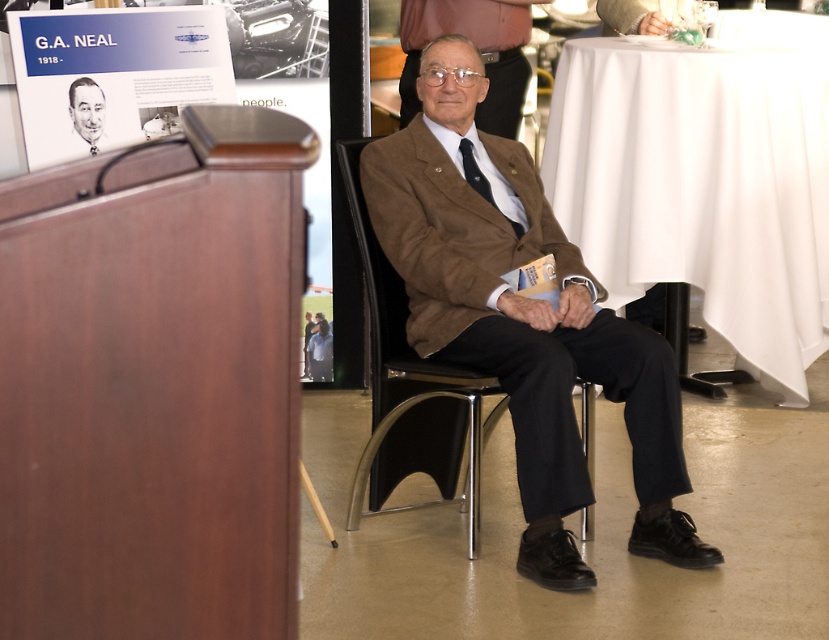
Question: In this image, where is matte paper poster at upper left located relative to matte black portrait at upper left?

Choices:
 (A) right
 (B) left

Answer: (A)

Question: Can you confirm if black plastic chair at center is wider than matte black portrait at upper left?

Choices:
 (A) no
 (B) yes

Answer: (B)

Question: Which of the following is the closest to the observer?

Choices:
 (A) black plastic chair at center
 (B) brown woolen suit at center
 (C) matte paper poster at upper left
 (D) white cloth at right

Answer: (B)

Question: Which point appears closest to the camera in this image?

Choices:
 (A) (812, 52)
 (B) (393, 333)

Answer: (B)

Question: In this image, where is brown woolen suit at center located relative to black plastic chair at center?

Choices:
 (A) below
 (B) above

Answer: (B)

Question: Which point appears farthest from the camera in this image?

Choices:
 (A) (381, 484)
 (B) (565, 461)

Answer: (A)